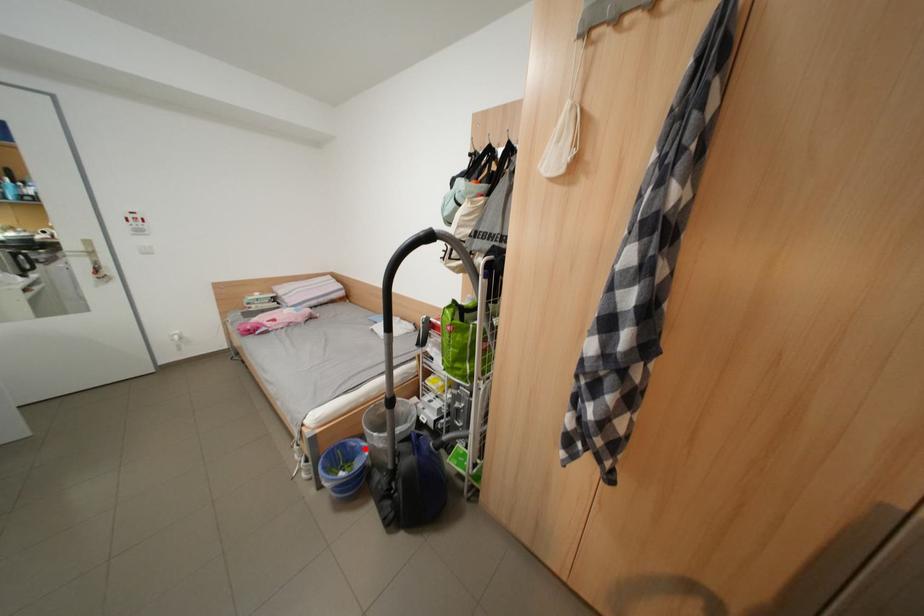
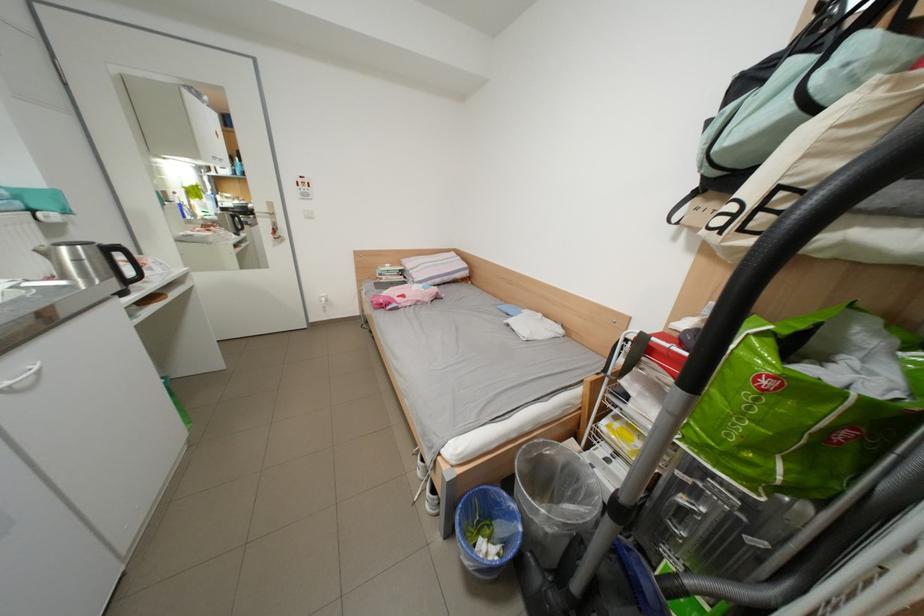
Find the pixel in the second image that matches the highlighted location in the first image.

(509, 506)